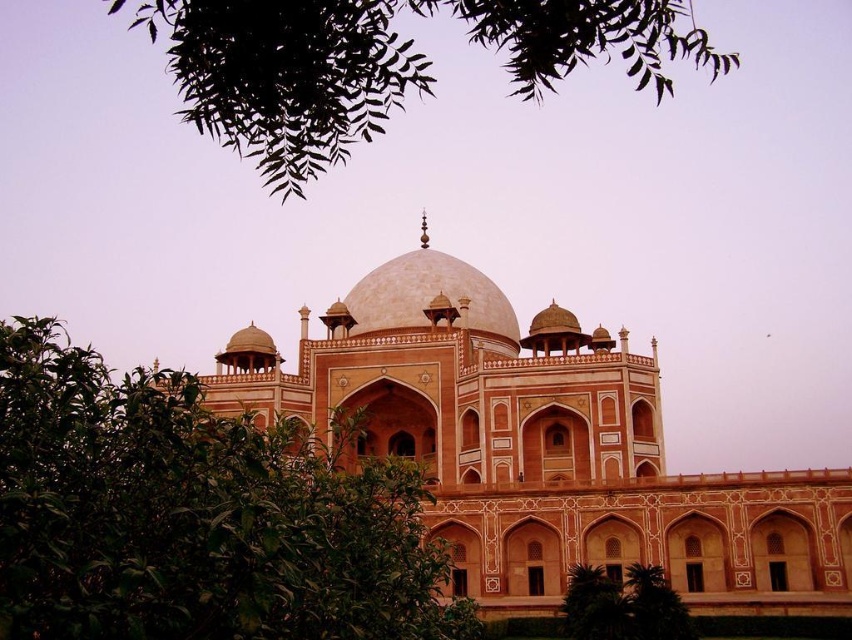
Consider the image. You are standing in front of the beige stone palace at center and the smooth beige dome at center. Which one is more to the left?

The smooth beige dome at center is more to the left because the beige stone palace at center is positioned on the right side of it.

You are standing in front of the beige stone palace at center and the green leafy tree at upper center. Which object is positioned to the right side?

The beige stone palace at center is positioned to the right of the green leafy tree at upper center.

You are an architect analyzing the layout of the beige stone palace at center and the green leafy tree at upper center in the image. Based on their positions, which object is situated higher in the scene?

The green leafy tree at upper center is situated higher in the scene than the beige stone palace at center.